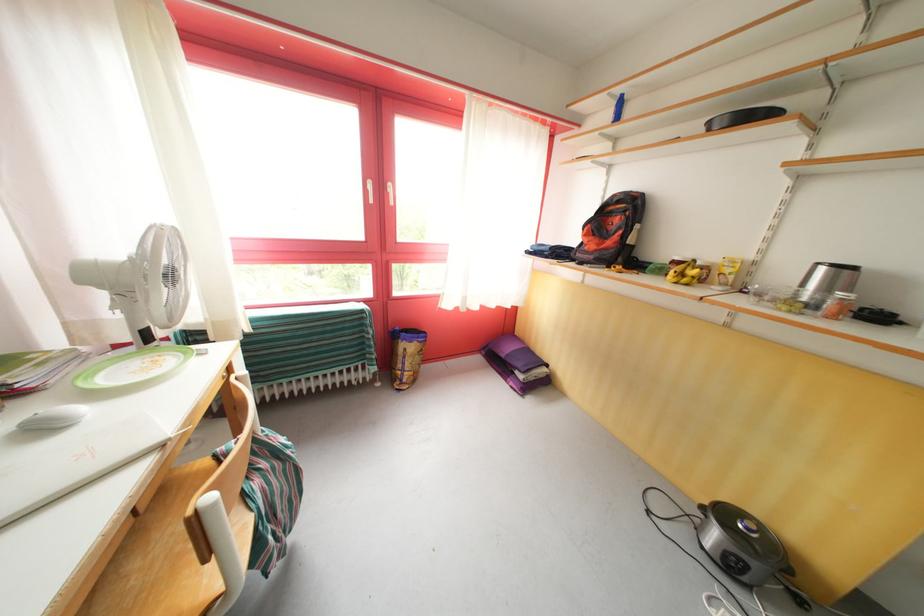
The location [611,230] corresponds to which object?

It corresponds to the orange and black backpack in the image.